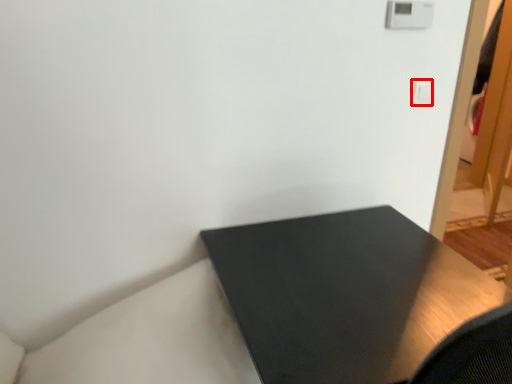
Question: Observing the image, what is the correct spatial positioning of light switch (annotated by the red box) in reference to table?

Choices:
 (A) right
 (B) left

Answer: (A)